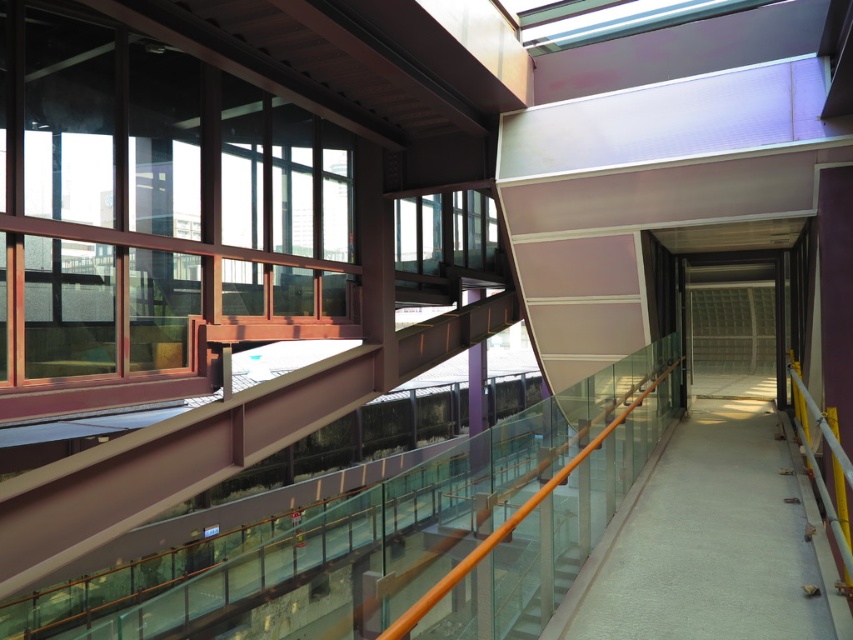
Question: Is smooth concrete walkway at center bigger than white glossy stairs at center?

Choices:
 (A) no
 (B) yes

Answer: (B)

Question: Which point is closer to the camera?

Choices:
 (A) click(549, 616)
 (B) click(682, 460)

Answer: (A)

Question: Among these points, which one is nearest to the camera?

Choices:
 (A) (764, 634)
 (B) (535, 593)

Answer: (A)

Question: Can you confirm if smooth concrete walkway at center is wider than white glossy stairs at center?

Choices:
 (A) yes
 (B) no

Answer: (A)

Question: Which point is farther to the camera?

Choices:
 (A) (544, 592)
 (B) (660, 480)

Answer: (B)

Question: Does smooth concrete walkway at center have a greater width compared to white glossy stairs at center?

Choices:
 (A) no
 (B) yes

Answer: (B)